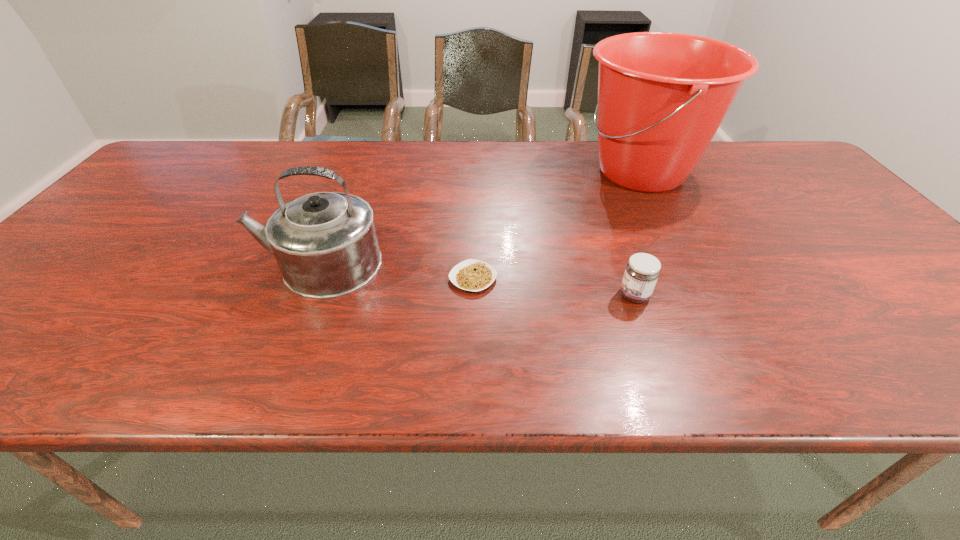
Locate an element on the screen. The width and height of the screenshot is (960, 540). the third closest object to the farthest object is located at coordinates (325, 243).

Select which object is the third closest to the farthest object. Please provide its 2D coordinates. Your answer should be formatted as a tuple, i.e. [(x, y)], where the tuple contains the x and y coordinates of a point satisfying the conditions above.

[(325, 243)]

This screenshot has height=540, width=960. Identify the location of vacant area that satisfies the following two spatial constraints: 1. with the spout at the front of the third shortest object; 2. on the right side of the third object from right to left. (312, 278).